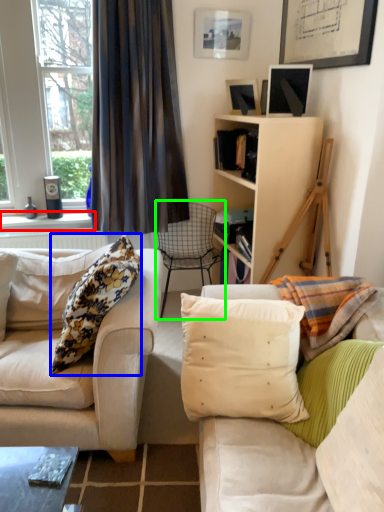
Question: Which object is positioned closest to window sill (highlighted by a red box)? Select from pillow (highlighted by a blue box) and chair (highlighted by a green box).

Choices:
 (A) pillow
 (B) chair

Answer: (B)